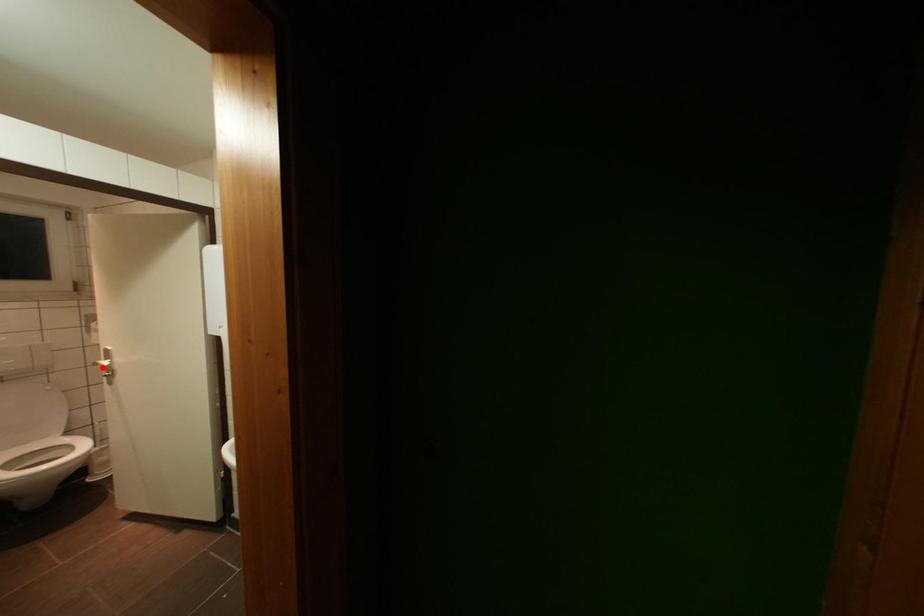
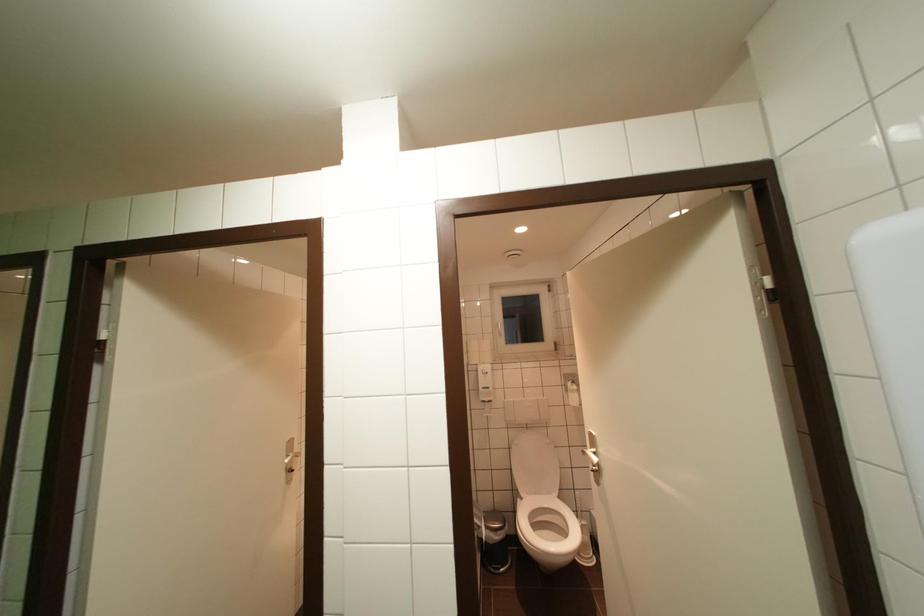
Question: I am providing you with two images of the same scene from different viewpoints. A red point is shown in image1. For the corresponding object point in image2, is it positioned nearer or farther from the camera?

Choices:
 (A) Nearer
 (B) Farther

Answer: (B)